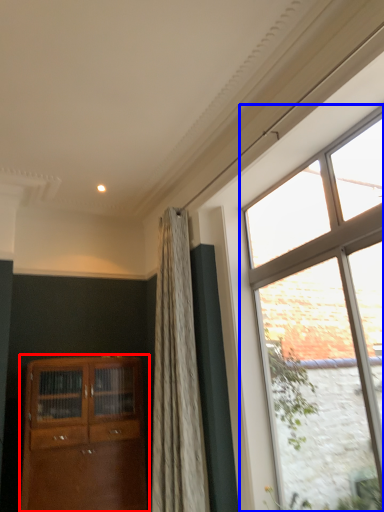
Question: Which object appears closest to the camera in this image, cabinetry (highlighted by a red box) or window (highlighted by a blue box)?

Choices:
 (A) cabinetry
 (B) window

Answer: (B)